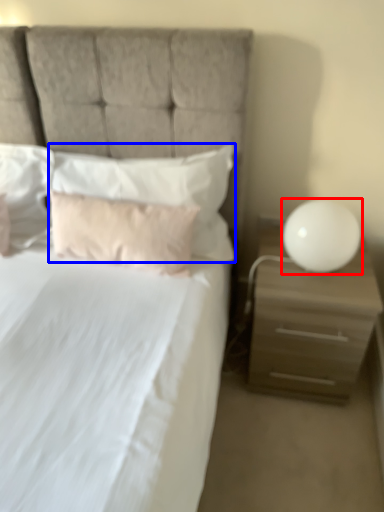
Question: Which point is closer to the camera, table lamp (highlighted by a red box) or pillow (highlighted by a blue box)?

Choices:
 (A) table lamp
 (B) pillow

Answer: (A)